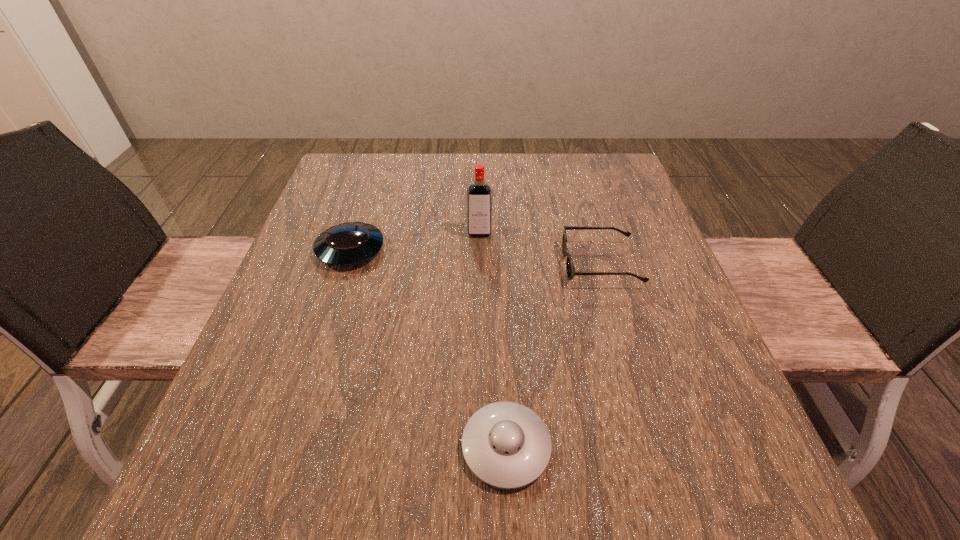
The height and width of the screenshot is (540, 960). In order to click on vodka in this screenshot , I will do `click(479, 194)`.

Find the location of a particular element. The image size is (960, 540). the left saucer is located at coordinates (351, 243).

The height and width of the screenshot is (540, 960). I want to click on the leftmost object, so click(351, 243).

Locate an element on the screen. The height and width of the screenshot is (540, 960). sunglasses is located at coordinates (570, 270).

Locate an element on the screen. The image size is (960, 540). the nearest object is located at coordinates click(506, 445).

This screenshot has height=540, width=960. What are the coordinates of `the right saucer` in the screenshot? It's located at point(506,445).

In order to click on blank space located 0.110m on the front and back of the tallest object in this screenshot , I will do `click(479, 271)`.

In order to click on vacant space located 0.070m on the right of the leftmost object in this screenshot , I will do `click(416, 250)`.

Where is `vacant space located on the front lenses of the rightmost object`? The image size is (960, 540). vacant space located on the front lenses of the rightmost object is located at coordinates (467, 265).

What are the coordinates of `vacant space located on the front lenses of the rightmost object` in the screenshot? It's located at (527, 265).